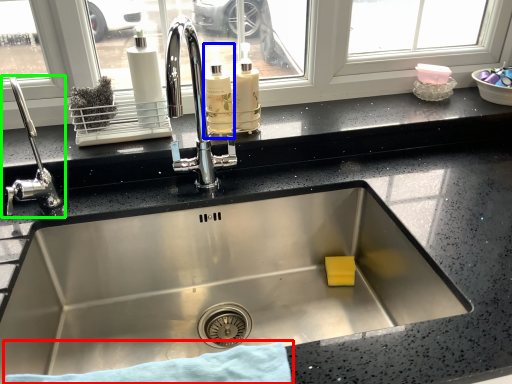
Question: Which object is positioned closest to bath towel (highlighted by a red box)? Select from bottle (highlighted by a blue box) and tap (highlighted by a green box).

Choices:
 (A) bottle
 (B) tap

Answer: (B)